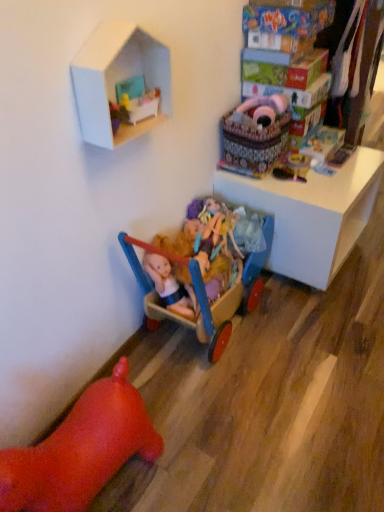
This screenshot has height=512, width=384. Identify the location of free space in front of wooden toy at center, the 2th toy in the right-to-left sequence. (316, 187).